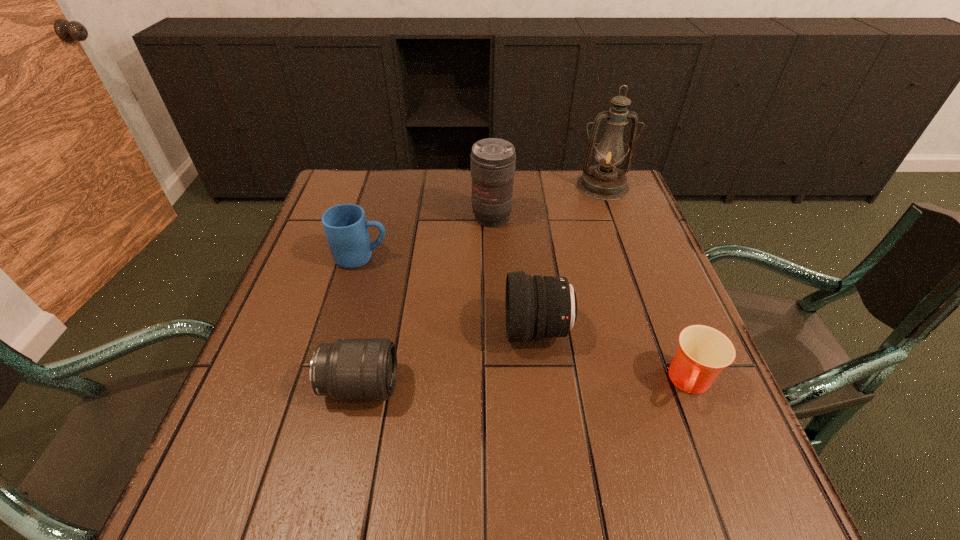
The width and height of the screenshot is (960, 540). I want to click on empty space between the farthest object and the second tallest telephoto lens, so click(x=570, y=258).

Identify the location of free space that is in between the farthest object and the second tallest object. (547, 202).

At what (x,y) coordinates should I click in order to perform the action: click on free space between the farthest telephoto lens and the cup. Please return your answer as a coordinate pair (x, y). This screenshot has width=960, height=540. Looking at the image, I should click on (591, 300).

This screenshot has height=540, width=960. What are the coordinates of `vacant space that's between the mug and the second farthest object` in the screenshot? It's located at (427, 238).

Where is `free space between the fourth nearest object and the second tallest telephoto lens`? This screenshot has width=960, height=540. free space between the fourth nearest object and the second tallest telephoto lens is located at coordinates (450, 294).

Identify the location of free space between the cup and the farthest telephoto lens. (591, 300).

Find the location of `vacant space that is in between the cup and the tallest object`. vacant space that is in between the cup and the tallest object is located at coordinates (646, 285).

Find the location of `object that can be found as the second closest to the cup`. object that can be found as the second closest to the cup is located at coordinates 492,160.

Find the location of a particular element. The height and width of the screenshot is (540, 960). the second closest object to the leftmost telephoto lens is located at coordinates (346, 229).

Identify the location of the second closest telephoto lens to the tallest telephoto lens. This screenshot has height=540, width=960. (349, 369).